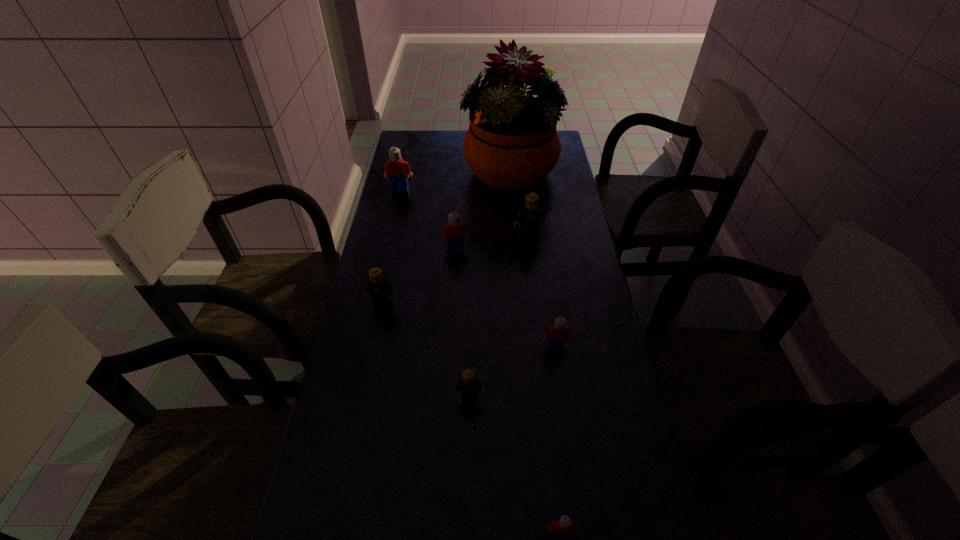
Locate an element on the screen. This screenshot has width=960, height=540. vacant area between the second white Lego from left to right and the farthest Lego is located at coordinates (428, 219).

Identify the location of vacant space that's between the sixth farthest Lego and the farthest white Lego. The image size is (960, 540). pos(435,294).

What are the coordinates of `free space that is in between the sixth farthest object and the second farthest Lego` in the screenshot? It's located at tap(542, 292).

Find the location of a particular element. vacant point located between the tallest object and the nearest object is located at coordinates (535, 353).

Locate an element on the screen. The width and height of the screenshot is (960, 540). vacant point located between the sixth nearest object and the leftmost white Lego is located at coordinates (465, 213).

You are a GUI agent. You are given a task and a screenshot of the screen. Output one action in this format:
    pyautogui.click(x=<x>, y=<y>)
    Task: Click on the vacant area that lies between the rightmost tan Lego and the third smallest white Lego
    This screenshot has height=540, width=960.
    Given the screenshot: What is the action you would take?
    pyautogui.click(x=492, y=242)

Where is `free space between the second smallest tan Lego and the second nearest Lego`? Image resolution: width=960 pixels, height=540 pixels. free space between the second smallest tan Lego and the second nearest Lego is located at coordinates (426, 352).

Select which object appears as the fourth closest to the third farthest white Lego. Please provide its 2D coordinates. Your answer should be formatted as a tuple, i.e. [(x, y)], where the tuple contains the x and y coordinates of a point satisfying the conditions above.

[(380, 289)]

The width and height of the screenshot is (960, 540). I want to click on the fourth closest object relative to the fourth farthest object, so click(x=396, y=168).

Locate an element on the screen. Lego that is the third closest one to the smallest white Lego is located at coordinates (380, 289).